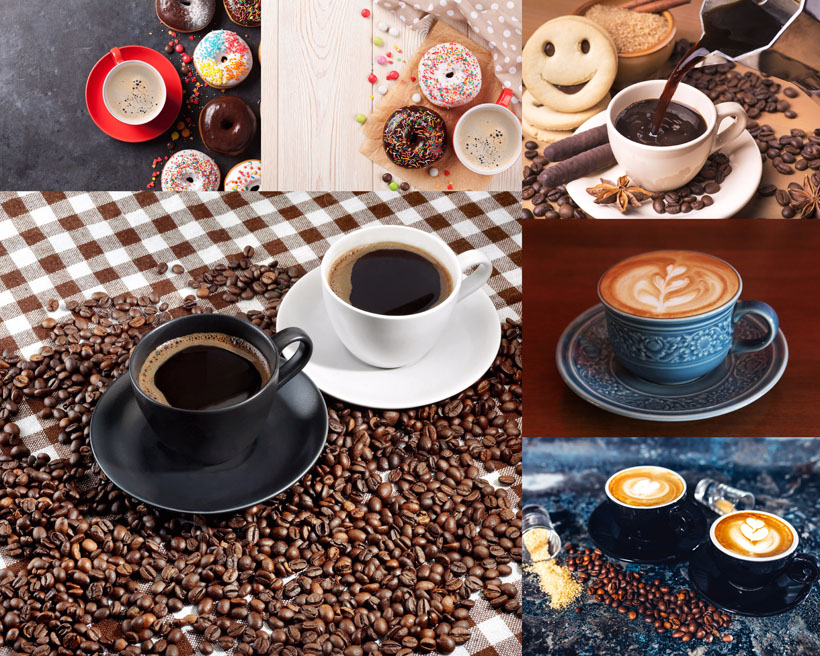
Where is `teacup handles`? The image size is (820, 656). teacup handles is located at coordinates (684, 523), (803, 560), (476, 258), (294, 337), (754, 310), (727, 108), (506, 96), (114, 51).